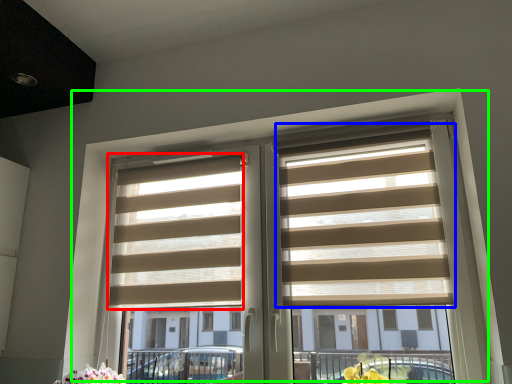
Question: Considering the real-world distances, which object is closest to blind (highlighted by a red box)? blind (highlighted by a blue box) or window (highlighted by a green box).

Choices:
 (A) blind
 (B) window

Answer: (B)